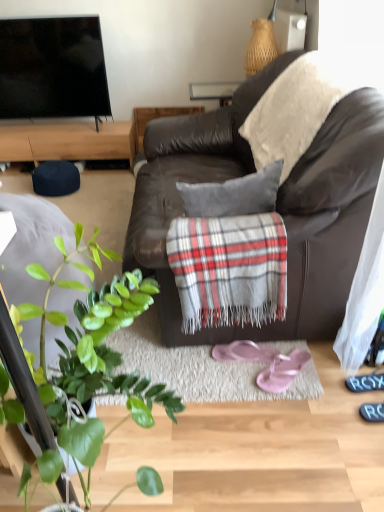
Question: Is the position of plaid woolen blanket at upper right less distant than that of black rubber shoe at lower right?

Choices:
 (A) no
 (B) yes

Answer: (A)

Question: Is plaid woolen blanket at upper right positioned behind black rubber shoe at lower right?

Choices:
 (A) no
 (B) yes

Answer: (B)

Question: Does plaid woolen blanket at upper right appear on the right side of black rubber shoe at lower right?

Choices:
 (A) no
 (B) yes

Answer: (A)

Question: Would you say black rubber shoe at lower right is part of plaid woolen blanket at upper right's contents?

Choices:
 (A) no
 (B) yes

Answer: (A)

Question: Could you tell me if plaid woolen blanket at upper right is turned towards black rubber shoe at lower right?

Choices:
 (A) no
 (B) yes

Answer: (A)

Question: Is point (41, 370) closer or farther from the camera than point (268, 375)?

Choices:
 (A) farther
 (B) closer

Answer: (B)

Question: Is green leafy plant at lower left in front of or behind pink rubber flip-flops at lower center, the 2th footwear viewed from the left, in the image?

Choices:
 (A) front
 (B) behind

Answer: (A)

Question: Based on their positions, is green leafy plant at lower left located to the left or right of pink rubber flip-flops at lower center, the 2th footwear viewed from the left?

Choices:
 (A) right
 (B) left

Answer: (B)

Question: From the image's perspective, relative to pink rubber flip-flops at lower center, positioned as the 1th footwear in right-to-left order, is green leafy plant at lower left above or below?

Choices:
 (A) below
 (B) above

Answer: (B)

Question: Considering the positions of pink fabric flip-flops at center, arranged as the second footwear when viewed from the right, and green leafy plant at lower left in the image, is pink fabric flip-flops at center, arranged as the second footwear when viewed from the right, wider or thinner than green leafy plant at lower left?

Choices:
 (A) wide
 (B) thin

Answer: (B)

Question: Is point (246, 344) closer or farther from the camera than point (91, 372)?

Choices:
 (A) closer
 (B) farther

Answer: (B)

Question: From the image's perspective, relative to green leafy plant at lower left, is pink fabric flip-flops at center, arranged as the second footwear when viewed from the right, above or below?

Choices:
 (A) below
 (B) above

Answer: (A)

Question: In the image, is pink fabric flip-flops at center, arranged as the second footwear when viewed from the right, positioned in front of or behind green leafy plant at lower left?

Choices:
 (A) behind
 (B) front

Answer: (A)

Question: From a real-world perspective, is plaid fabric at center positioned above or below black rubber shoe at lower right?

Choices:
 (A) below
 (B) above

Answer: (B)

Question: Is plaid fabric at center situated inside black rubber shoe at lower right or outside?

Choices:
 (A) inside
 (B) outside

Answer: (B)